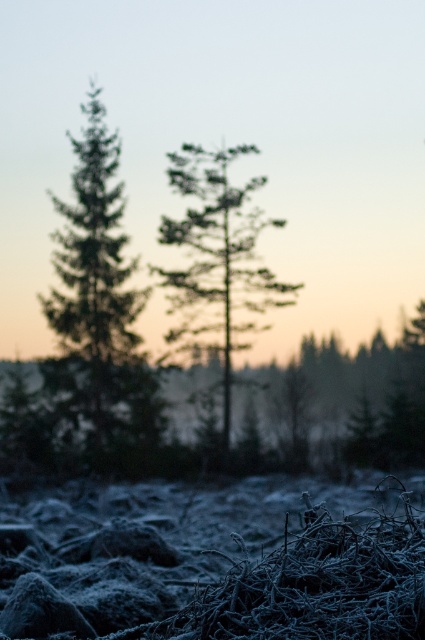
Does point (119, 308) lie in front of point (235, 218)?

Yes, point (119, 308) is closer to viewer.

Find the location of a particular element. This screenshot has width=425, height=640. green needle-like tree at left is located at coordinates (98, 307).

What do you see at coordinates (98, 307) in the screenshot?
I see `green needle-like tree at left` at bounding box center [98, 307].

Identify the location of green needle-like tree at left. (98, 307).